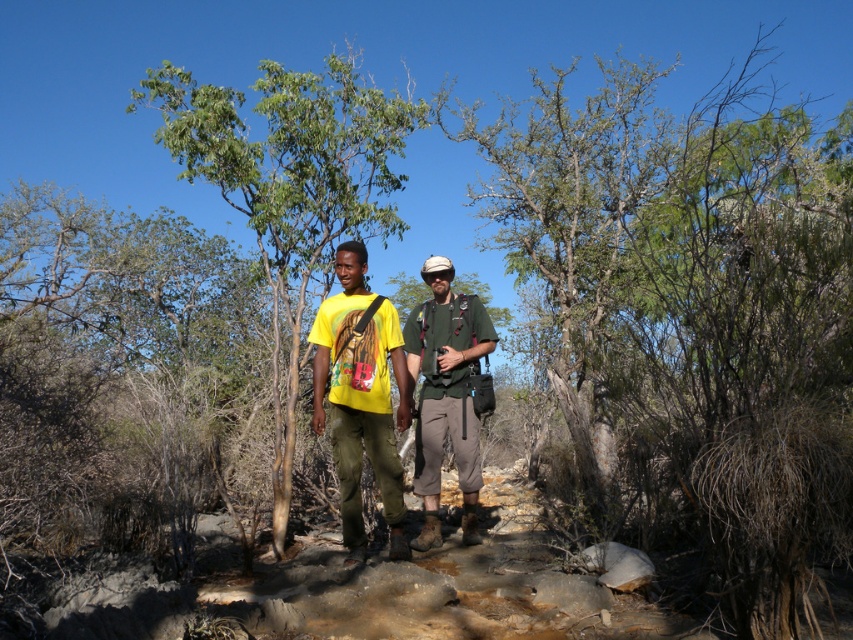
This screenshot has height=640, width=853. Describe the element at coordinates (289, 192) in the screenshot. I see `green leafy tree at center` at that location.

In the scene shown: Who is taller, green leafy tree at center or yellow matte t-shirt at center?

green leafy tree at center is taller.

Image resolution: width=853 pixels, height=640 pixels. What do you see at coordinates (289, 192) in the screenshot?
I see `green leafy tree at center` at bounding box center [289, 192].

Find the location of `green leafy tree at center`. green leafy tree at center is located at coordinates (289, 192).

In the scene shown: Can you confirm if yellow matte t-shirt at center is smaller than green fabric shirt at center?

Indeed, yellow matte t-shirt at center has a smaller size compared to green fabric shirt at center.

Who is positioned more to the right, yellow matte t-shirt at center or green fabric shirt at center?

green fabric shirt at center

Who is more distant from viewer, (357,440) or (427,394)?

The point (427,394) is more distant.

What are the coordinates of `yellow matte t-shirt at center` in the screenshot? It's located at (361, 396).

Who is positioned more to the left, green leafy tree at center or green fabric shirt at center?

From the viewer's perspective, green leafy tree at center appears more on the left side.

Does point (294, 250) come behind point (434, 483)?

Yes, point (294, 250) is behind point (434, 483).

This screenshot has height=640, width=853. In order to click on green leafy tree at center in this screenshot , I will do `click(289, 192)`.